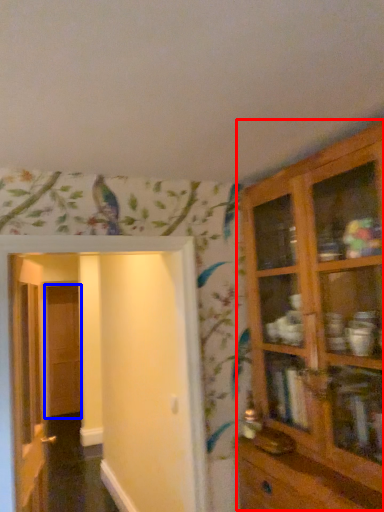
Question: Which point is closer to the camera, cupboard (highlighted by a red box) or door (highlighted by a blue box)?

Choices:
 (A) cupboard
 (B) door

Answer: (A)